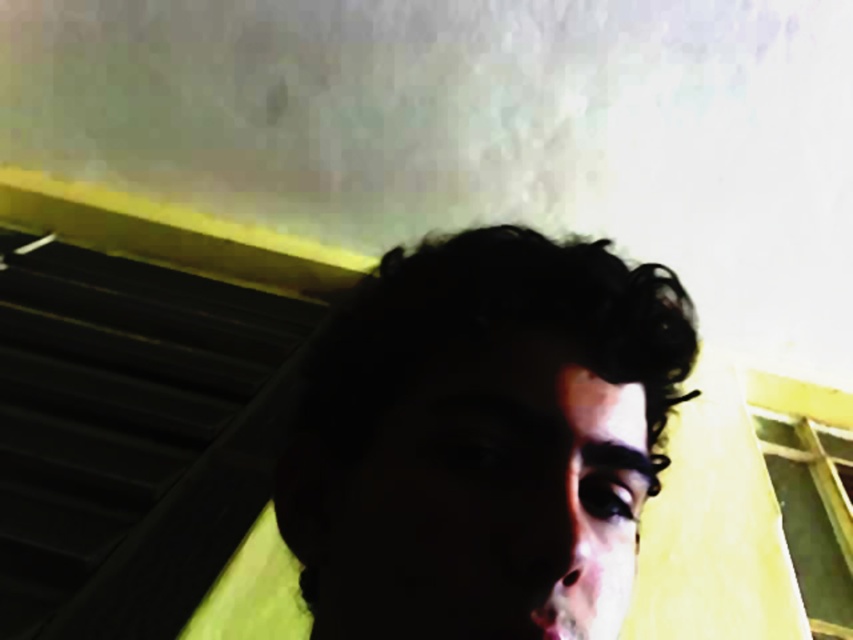
Question: Can you confirm if dark curly hair at center is thinner than black plastic stair at upper left?

Choices:
 (A) no
 (B) yes

Answer: (B)

Question: Which of the following is the closest to the observer?

Choices:
 (A) (172, 344)
 (B) (367, 460)

Answer: (B)

Question: Among these objects, which one is farthest from the camera?

Choices:
 (A) dark curly hair at center
 (B) black plastic stair at upper left

Answer: (B)

Question: Is dark curly hair at center wider than black plastic stair at upper left?

Choices:
 (A) yes
 (B) no

Answer: (B)

Question: From the image, what is the correct spatial relationship of dark curly hair at center in relation to black plastic stair at upper left?

Choices:
 (A) left
 (B) right

Answer: (B)